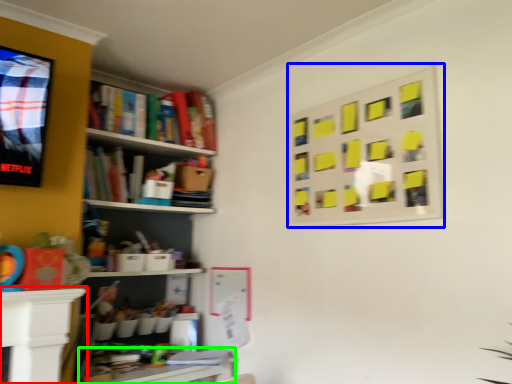
Question: Based on their relative distances, which object is farther from table (highlighted by a red box)? Choose from bulletin board (highlighted by a blue box) and table (highlighted by a green box).

Choices:
 (A) bulletin board
 (B) table

Answer: (A)